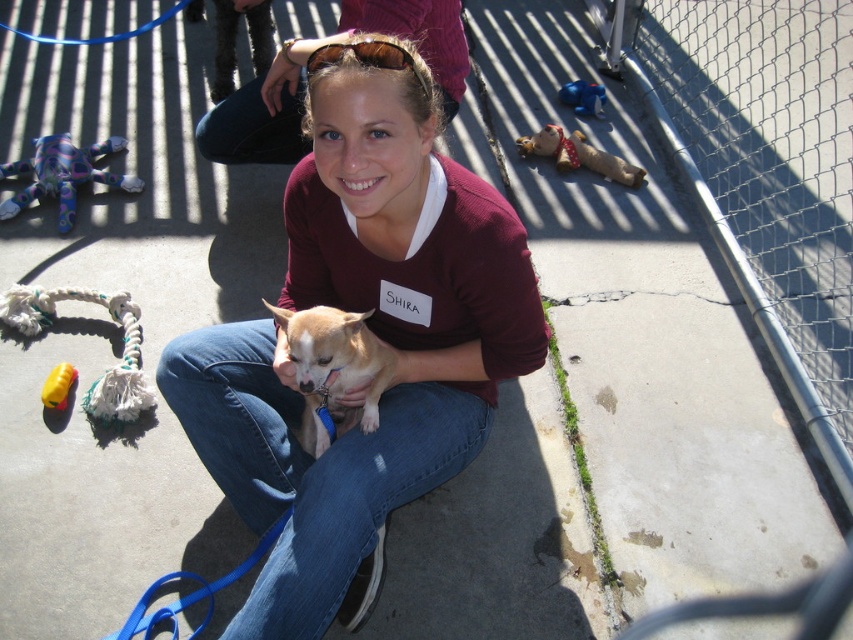
Which of these two, matte brown hair at upper center or blue plush toy at upper center, stands taller?

Standing taller between the two is matte brown hair at upper center.

Does point (349, 28) come farther from viewer compared to point (577, 109)?

That is False.

Who is more forward, (201, 148) or (577, 93)?

Positioned in front is point (201, 148).

Locate an element on the screen. This screenshot has width=853, height=640. matte brown hair at upper center is located at coordinates (303, 84).

Is light brown fur at center bigger than blue plush toy at upper center?

Yes.

Between light brown fur at center and blue plush toy at upper center, which one appears on the left side from the viewer's perspective?

light brown fur at center is more to the left.

Does point (317, 412) come closer to viewer compared to point (595, 104)?

Yes, it is in front of point (595, 104).

Image resolution: width=853 pixels, height=640 pixels. Identify the location of light brown fur at center. (334, 369).

Is plush multicolored stuffed animal at left to the left of yellow rubber toy at lower left from the viewer's perspective?

Indeed, plush multicolored stuffed animal at left is positioned on the left side of yellow rubber toy at lower left.

Between point (47, 172) and point (47, 404), which one is positioned behind?

Point (47, 172)

Is point (53, 180) less distant than point (55, 406)?

No, it is behind (55, 406).

You are a GUI agent. You are given a task and a screenshot of the screen. Output one action in this format:
    pyautogui.click(x=<x>, y=<y>)
    Task: Click on the plush multicolored stuffed animal at left
    The width and height of the screenshot is (853, 640).
    Given the screenshot: What is the action you would take?
    pyautogui.click(x=62, y=173)